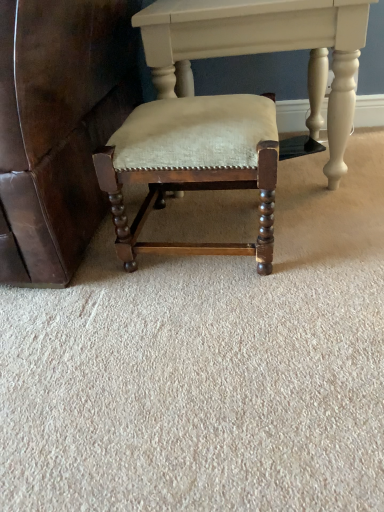
Locate an element on the screen. free space between matte wood chair at center and matte white table at center is located at coordinates (302, 222).